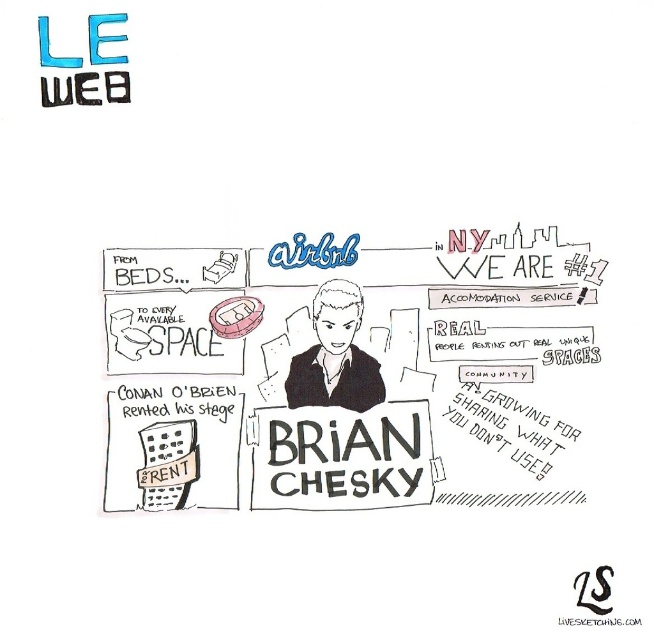
Question: Considering the relative positions of black paper sign at center and black matte portrait at center in the image provided, where is black paper sign at center located with respect to black matte portrait at center?

Choices:
 (A) left
 (B) right

Answer: (B)

Question: Can you confirm if black paper sign at center is positioned above black matte portrait at center?

Choices:
 (A) yes
 (B) no

Answer: (B)

Question: Which point is farther from the camera taking this photo?

Choices:
 (A) (283, 436)
 (B) (328, 337)

Answer: (B)

Question: Is black paper sign at center to the right of black matte portrait at center from the viewer's perspective?

Choices:
 (A) no
 (B) yes

Answer: (B)

Question: Among these points, which one is nearest to the camera?

Choices:
 (A) (311, 429)
 (B) (313, 326)

Answer: (A)